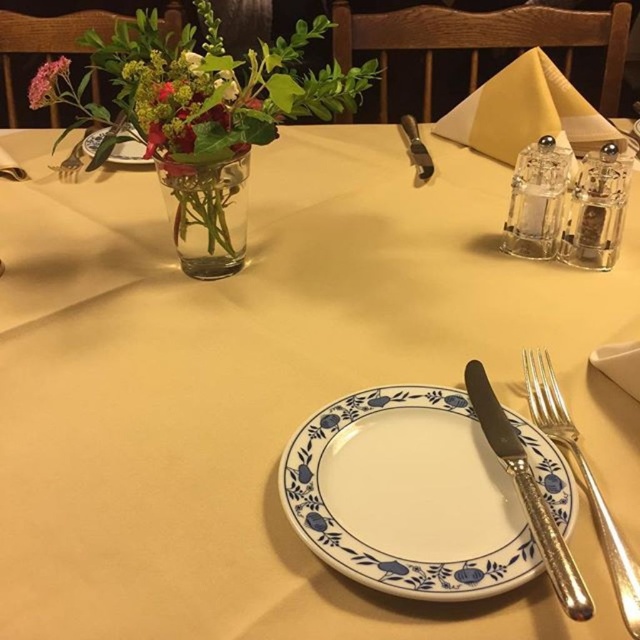
Question: Does translucent glass vase at upper left have a smaller size compared to pink matte flower at upper left?

Choices:
 (A) no
 (B) yes

Answer: (A)

Question: Does white porcelain plate at center appear over silver plated knife at right?

Choices:
 (A) no
 (B) yes

Answer: (A)

Question: Can you confirm if translucent glass vase at upper left is smaller than polished metal knife at upper center?

Choices:
 (A) yes
 (B) no

Answer: (B)

Question: Which point is closer to the camera?

Choices:
 (A) white porcelain plate at upper center
 (B) clear glass vase at upper left
 (C) pink matte flower at upper left
 (D) white porcelain plate at center

Answer: (D)

Question: Which point is closer to the camera?

Choices:
 (A) white porcelain plate at center
 (B) clear glass vase at upper left

Answer: (A)

Question: Which of the following is the farthest from the observer?

Choices:
 (A) (545, 396)
 (B) (129, 128)
 (C) (477, 497)
 (D) (426, 170)

Answer: (D)